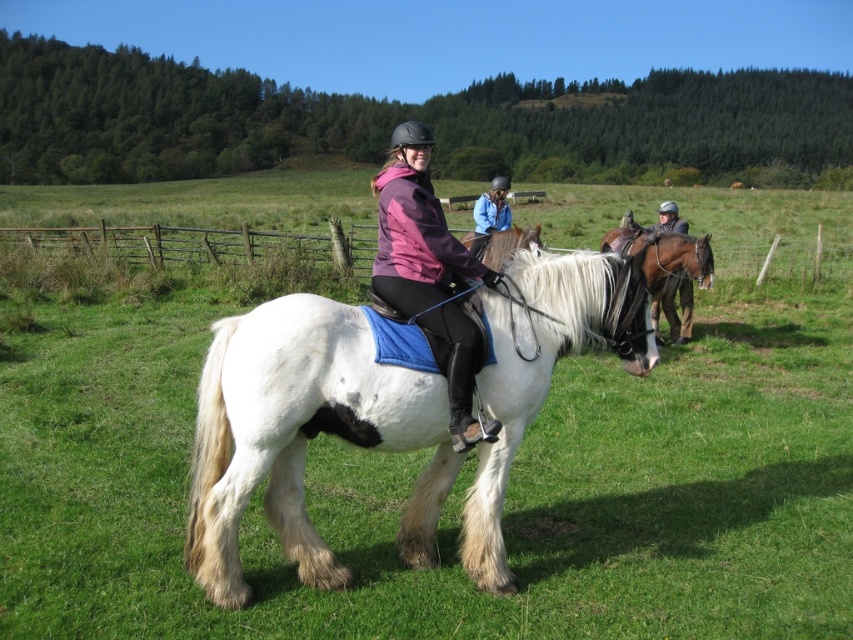
Is white soft fur horse at center positioned behind dark brown leather jacket at center?

No, white soft fur horse at center is in front of dark brown leather jacket at center.

Describe the element at coordinates (302, 435) in the screenshot. The height and width of the screenshot is (640, 853). I see `white soft fur horse at center` at that location.

The height and width of the screenshot is (640, 853). I want to click on white soft fur horse at center, so click(302, 435).

Is brown glossy horse at center closer to camera compared to blue matte jacket at center?

Yes, brown glossy horse at center is closer to the viewer.

Between brown glossy horse at center and blue matte jacket at center, which one appears on the right side from the viewer's perspective?

Positioned to the right is brown glossy horse at center.

Where is `brown glossy horse at center`? brown glossy horse at center is located at coordinates (666, 269).

Where is `brown glossy horse at center`? This screenshot has width=853, height=640. brown glossy horse at center is located at coordinates pyautogui.click(x=666, y=269).

Who is more forward, (471, 401) or (669, 220)?

Positioned in front is point (471, 401).

How far apart are purple fleece jacket at center and dark brown leather jacket at center?

They are 20.40 feet apart.

Who is more forward, (432, 232) or (688, 317)?

Point (432, 232) is more forward.

Identify the location of purple fleece jacket at center. (428, 273).